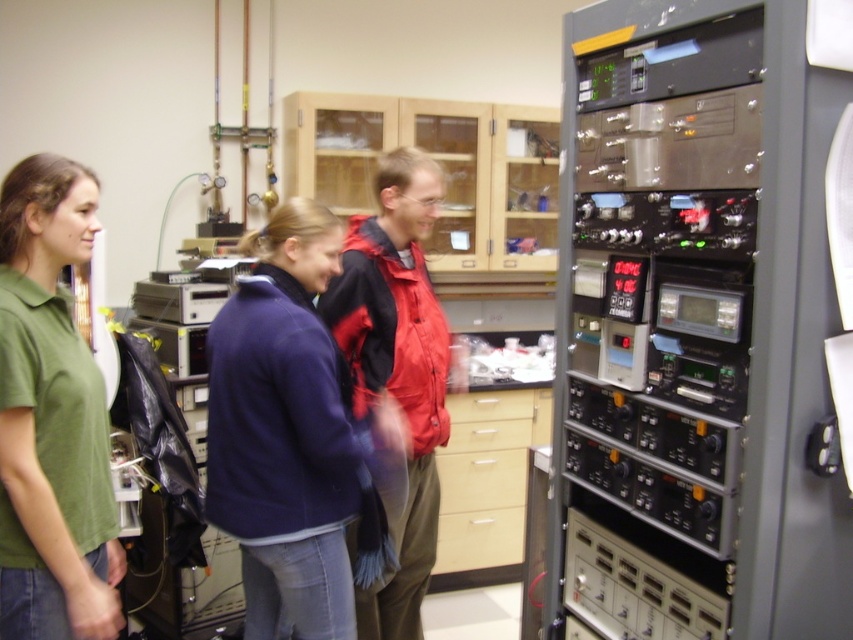
You are standing in the laboratory and need to find the green cotton shirt at left. Based on the coordinates provided in the Objects Description, can you determine its position relative to the center of the image?

The green cotton shirt at left is located at point coordinates of 0.655 on the x axis and 0.061 on the y axis, which places it to the right and slightly below the center of the image.

In the laboratory scene, there are two people wearing coats and jackets near the electronic equipment rack. The individuals are wearing a navy blue fabric coat at center and a red matte jacket at center. Which of these two garments is shorter in length?

The navy blue fabric coat at center is shorter than the red matte jacket at center.